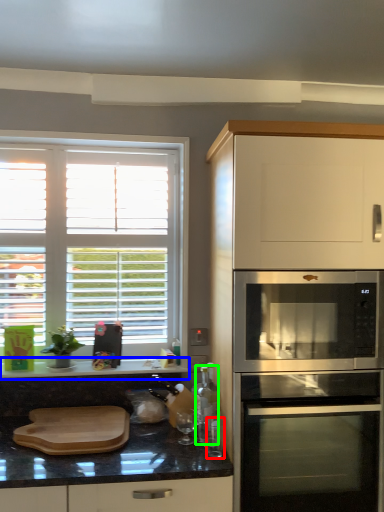
Question: Based on their relative distances, which object is nearer to appliance (highlighted by a red box)? Choose from countertop (highlighted by a blue box) and bottle (highlighted by a green box).

Choices:
 (A) countertop
 (B) bottle

Answer: (B)